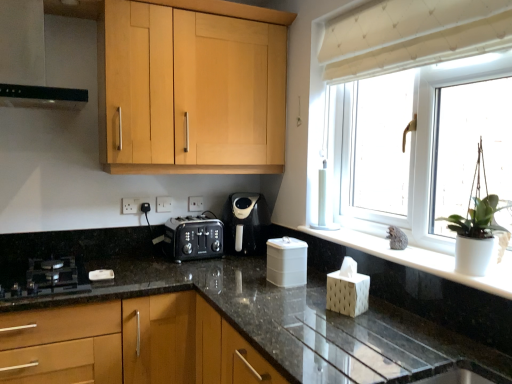
The image size is (512, 384). I want to click on matte black toaster at center, which is the 2th cabinetry from top to bottom, so click(x=129, y=344).

What do you see at coordinates (195, 203) in the screenshot? I see `white plastic electric outlet at center, the first electric outlet viewed from the back` at bounding box center [195, 203].

This screenshot has height=384, width=512. I want to click on light wood cabinet at upper center, which is the first cabinetry in top-to-bottom order, so pyautogui.click(x=191, y=90).

Could you tell me if white matte plant at right is facing light wood cabinet at upper center, which is counted as the second cabinetry, starting from the bottom?

No, white matte plant at right is not turned towards light wood cabinet at upper center, which is counted as the second cabinetry, starting from the bottom.

Where is `cabinetry that is above the white matte plant at right (from a real-world perspective)`? cabinetry that is above the white matte plant at right (from a real-world perspective) is located at coordinates (191, 90).

Can you tell me how much white matte plant at right and light wood cabinet at upper center, which is the first cabinetry in top-to-bottom order, differ in facing direction?

The angular difference between white matte plant at right and light wood cabinet at upper center, which is the first cabinetry in top-to-bottom order, is 91.3 degrees.

Is black glass gas stove at lower left completely or partially inside white plastic container at center?

No, white plastic container at center does not contain black glass gas stove at lower left.

Visually, is white plastic container at center positioned to the left or to the right of black glass gas stove at lower left?

Based on their positions, white plastic container at center is located to the right of black glass gas stove at lower left.

Measure the distance from white plastic container at center to black glass gas stove at lower left.

white plastic container at center and black glass gas stove at lower left are 33.99 inches apart from each other.

Which of these two, white plastic container at center or black glass gas stove at lower left, stands taller?

With more height is white plastic container at center.

Between white plastic electric outlet at center, placed as the first electric outlet when sorted from front to back, and white plastic window at upper right, which one has smaller width?

Thinner between the two is white plastic electric outlet at center, placed as the first electric outlet when sorted from front to back.

Relative to white plastic window at upper right, is white plastic electric outlet at center, placed as the first electric outlet when sorted from front to back, in front or behind?

Clearly, white plastic electric outlet at center, placed as the first electric outlet when sorted from front to back, is behind white plastic window at upper right.

From a real-world perspective, between white plastic electric outlet at center, acting as the 2th electric outlet starting from the right, and white plastic window at upper right, who is vertically lower?

white plastic electric outlet at center, acting as the 2th electric outlet starting from the right, from a real-world perspective.

Is white plastic electric outlet at center, acting as the 2th electric outlet starting from the right, directly adjacent to white plastic window at upper right?

white plastic electric outlet at center, acting as the 2th electric outlet starting from the right, and white plastic window at upper right are not in contact.

Relative to light wood cabinet at upper center, which is the first cabinetry in top-to-bottom order, is white plastic container at center in front or behind?

In the image, white plastic container at center appears behind light wood cabinet at upper center, which is the first cabinetry in top-to-bottom order.

Identify the location of appliance below the light wood cabinet at upper center, which is the first cabinetry in top-to-bottom order (from a real-world perspective). This screenshot has width=512, height=384. (286, 262).

Can you tell me how much white plastic container at center and light wood cabinet at upper center, which is counted as the second cabinetry, starting from the bottom, differ in facing direction?

The angular difference between white plastic container at center and light wood cabinet at upper center, which is counted as the second cabinetry, starting from the bottom, is 89.8 degrees.

Is white plastic container at center far away from light wood cabinet at upper center, which is counted as the second cabinetry, starting from the bottom?

No.

Considering the sizes of objects white matte window sill at center and matte black toaster at center, which is the 2th cabinetry from top to bottom, in the image provided, who is shorter, white matte window sill at center or matte black toaster at center, which is the 2th cabinetry from top to bottom,?

Standing shorter between the two is white matte window sill at center.

In the scene shown: From the image's perspective, relative to matte black toaster at center, which is the 2th cabinetry from top to bottom, is white matte window sill at center above or below?

From the image's perspective, white matte window sill at center appears above matte black toaster at center, which is the 2th cabinetry from top to bottom.

Would you say white matte window sill at center is outside matte black toaster at center, which is the 2th cabinetry from top to bottom?

Absolutely, white matte window sill at center is external to matte black toaster at center, which is the 2th cabinetry from top to bottom.

Could you measure the distance between white matte window sill at center and matte black toaster at center, acting as the first cabinetry starting from the bottom?

white matte window sill at center and matte black toaster at center, acting as the first cabinetry starting from the bottom, are 96.40 centimeters apart from each other.

Which is more to the right, white plastic container at center or matte black toaster at center, acting as the first cabinetry starting from the bottom?

Positioned to the right is white plastic container at center.

Is white plastic container at center facing towards matte black toaster at center, acting as the first cabinetry starting from the bottom?

No, white plastic container at center is not oriented towards matte black toaster at center, acting as the first cabinetry starting from the bottom.

Which of these two, white plastic container at center or matte black toaster at center, acting as the first cabinetry starting from the bottom, is bigger?

matte black toaster at center, acting as the first cabinetry starting from the bottom.

Considering the relative positions of white matte window sill at center and beige fabric curtain at upper right in the image provided, is white matte window sill at center to the left or to the right of beige fabric curtain at upper right?

white matte window sill at center is to the left of beige fabric curtain at upper right.

Is white matte window sill at center situated inside beige fabric curtain at upper right or outside?

The correct answer is: outside.

Is white matte window sill at center directly adjacent to beige fabric curtain at upper right?

They are not placed beside each other.

Considering the positions of objects white matte window sill at center and beige fabric curtain at upper right in the image provided, who is in front, white matte window sill at center or beige fabric curtain at upper right?

beige fabric curtain at upper right is more forward.

Find the location of `cabinetry above the white matte plant at right (from a real-world perspective)`. cabinetry above the white matte plant at right (from a real-world perspective) is located at coordinates (191, 90).

The image size is (512, 384). Find the location of `gas stove below the white plastic container at center (from a real-world perspective)`. gas stove below the white plastic container at center (from a real-world perspective) is located at coordinates (46, 280).

Based on their spatial positions, is black glass gas stove at lower left or white matte plant at right further from white plastic window at upper right?

white matte plant at right is further to white plastic window at upper right.

Estimate the real-world distances between objects in this image. Which object is closer to white plastic electric outlet at center, the first electric outlet from the right, light wood cabinet at upper center, which is the first cabinetry in top-to-bottom order, or white plastic electric outlet at center, acting as the 2th electric outlet starting from the right?

white plastic electric outlet at center, acting as the 2th electric outlet starting from the right.

From the image, which object appears to be nearer to black plastic coffee maker at center, white plastic electric outlet at center, the first electric outlet from the right, or beige fabric curtain at upper right?

Among the two, white plastic electric outlet at center, the first electric outlet from the right, is located nearer to black plastic coffee maker at center.

Which object lies nearer to the anchor point light wood cabinet at upper center, which is counted as the second cabinetry, starting from the bottom, white plastic container at center or white plastic electric outlet at center, the 2th electric outlet viewed from the left?

white plastic electric outlet at center, the 2th electric outlet viewed from the left, lies closer to light wood cabinet at upper center, which is counted as the second cabinetry, starting from the bottom, than the other object.

Which object lies further to the anchor point black plastic toaster at center, white plastic electric outlet at center, the 2th electric outlet viewed from the left, or white plastic electric outlet at center, the first electric outlet from the left?

white plastic electric outlet at center, the first electric outlet from the left, lies further to black plastic toaster at center than the other object.

Consider the image. Based on their spatial positions, is white matte plant at right or black glass gas stove at lower left closer to white plastic container at center?

black glass gas stove at lower left is closer to white plastic container at center.

Looking at the image, which one is located closer to black plastic coffee maker at center, white plastic electric outlet at center, the second electric outlet viewed from the front, or white matte window sill at center?

white plastic electric outlet at center, the second electric outlet viewed from the front, is positioned closer to the anchor black plastic coffee maker at center.

In the scene shown: Estimate the real-world distances between objects in this image. Which object is further from white matte window sill at center, black plastic coffee maker at center or white plastic container at center?

black plastic coffee maker at center lies further to white matte window sill at center than the other object.

The width and height of the screenshot is (512, 384). I want to click on curtain between black matte exhaust hood at upper left and white plastic window at upper right, so click(x=412, y=35).

Find the location of `window between beige fabric curtain at upper right and white matte plant at right from top to bottom`. window between beige fabric curtain at upper right and white matte plant at right from top to bottom is located at coordinates pyautogui.click(x=392, y=138).

Find the location of `toaster between light wood cabinet at upper center, which is the first cabinetry in top-to-bottom order, and black glass gas stove at lower left, in the vertical direction`. toaster between light wood cabinet at upper center, which is the first cabinetry in top-to-bottom order, and black glass gas stove at lower left, in the vertical direction is located at coordinates [193, 238].

Find the location of a particular element. This screenshot has height=384, width=512. appliance located between beige fabric curtain at upper right and white plastic electric outlet at center, the first electric outlet viewed from the back, in the depth direction is located at coordinates pyautogui.click(x=286, y=262).